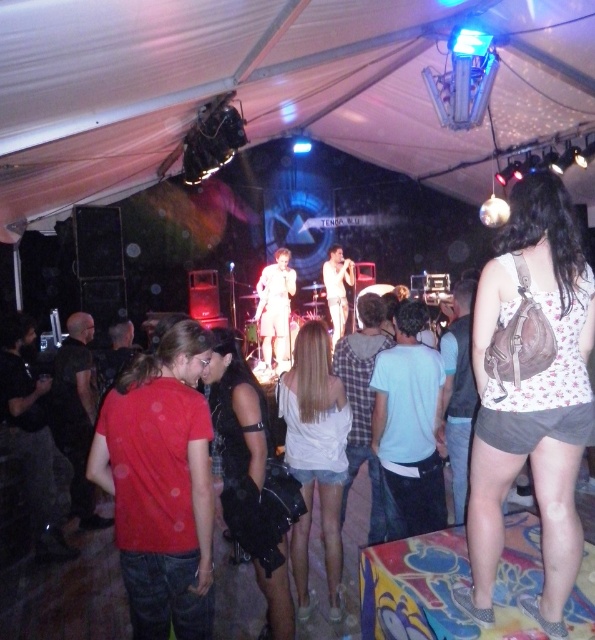
You are standing at the entrance of the tent and want to reach the stage. There are two points marked in the image, point A at coordinates point (580,540) and point B at coordinates point (270,314). Which point should you head towards to get closer to the stage?

Point A at coordinates point (580,540) is closer to the viewer, so heading towards point A would get you closer to the stage.